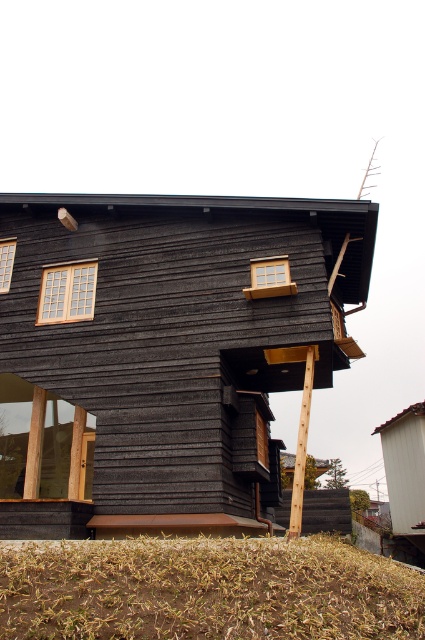
Is point (42, 448) less distant than point (3, 253)?

That is False.

Is transparent glass window at lower left shorter than matte wooden window at upper left?

In fact, transparent glass window at lower left may be taller than matte wooden window at upper left.

Locate an element on the screen. Image resolution: width=425 pixels, height=640 pixels. transparent glass window at lower left is located at coordinates (44, 445).

Can you confirm if brown grass at lower center is shorter than wooden window at center?

Indeed, brown grass at lower center has a lesser height compared to wooden window at center.

Is brown grass at lower center closer to camera compared to wooden window at center?

Yes, it is in front of wooden window at center.

I want to click on brown grass at lower center, so [206, 589].

Where is `brown grass at lower center`? brown grass at lower center is located at coordinates (206, 589).

Looking at this image, which of these two, brown grass at lower center or matte wooden window at upper left, stands shorter?

Standing shorter between the two is brown grass at lower center.

Find the location of a particular element. This screenshot has height=640, width=425. brown grass at lower center is located at coordinates pyautogui.click(x=206, y=589).

Identify the location of brown grass at lower center. The width and height of the screenshot is (425, 640). (206, 589).